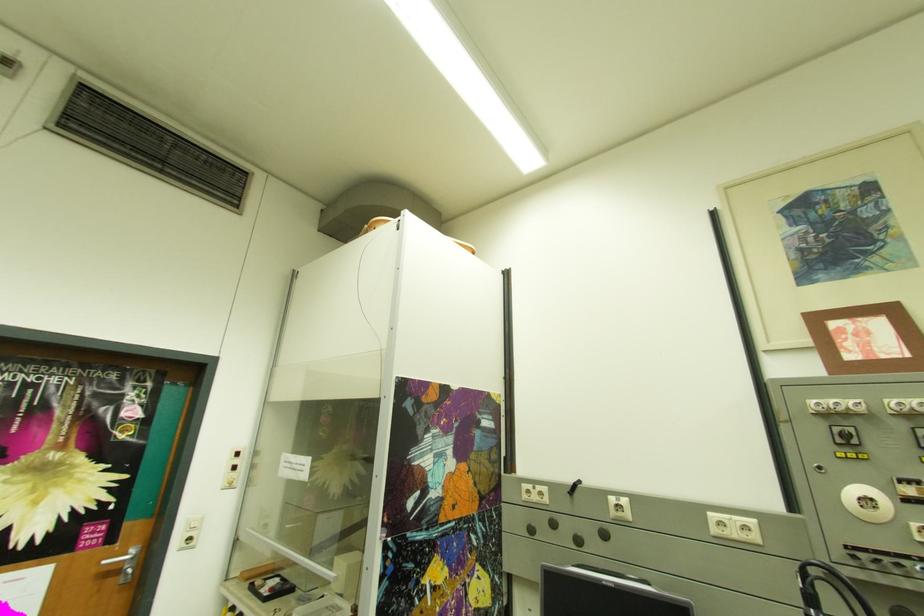
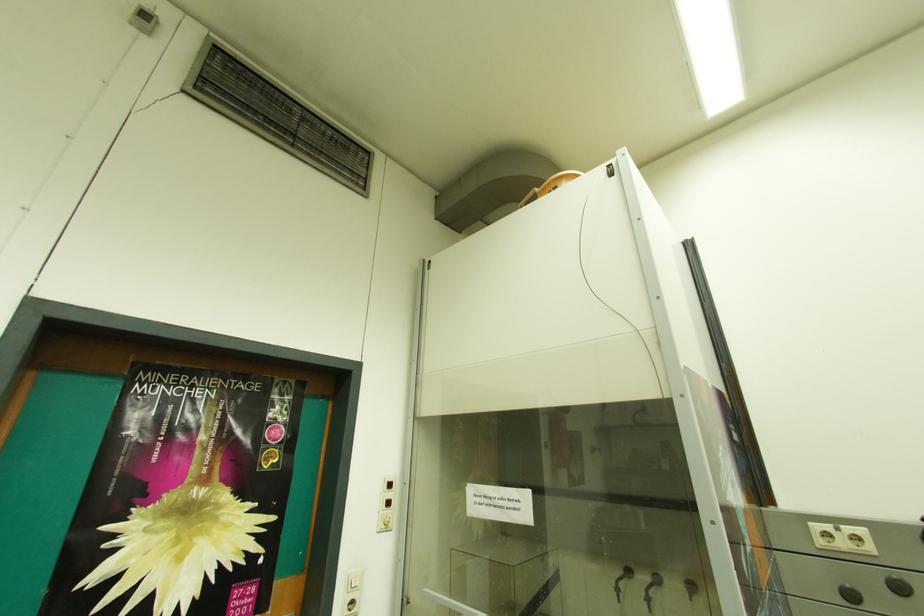
The point at (564,525) is marked in the first image. Where is the corresponding point in the second image?

(910, 590)